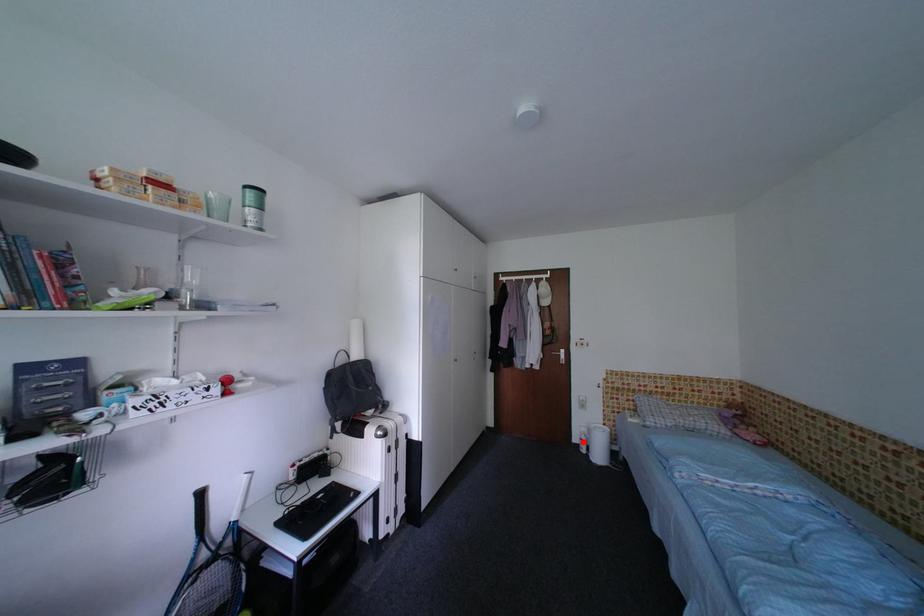
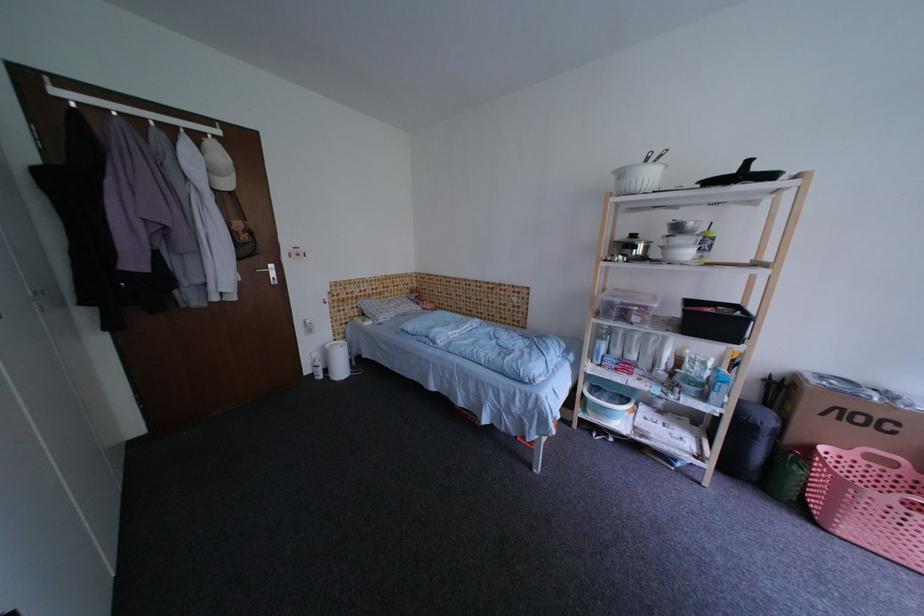
Where in the second image is the point corresponding to the highlighted location from the first image?

(314, 374)